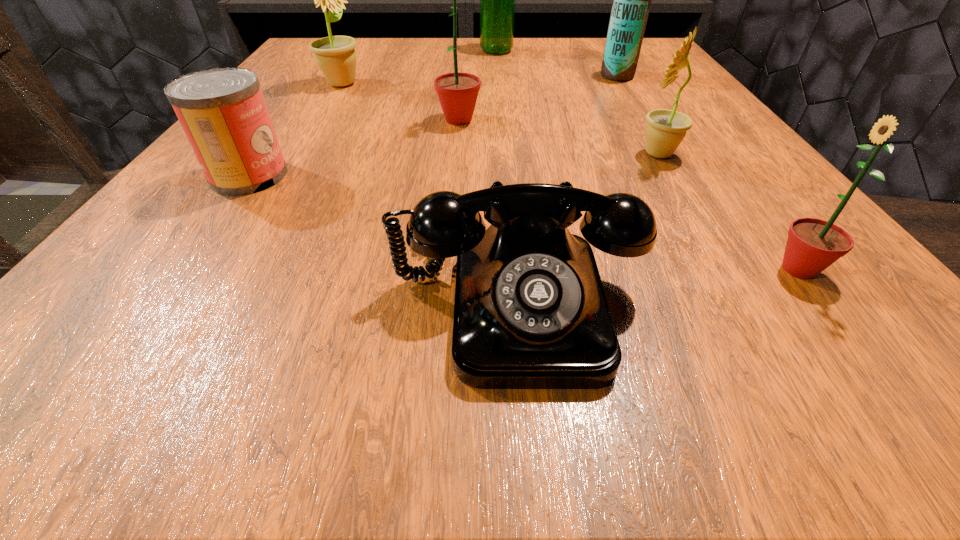
What are the coordinates of `vacant space situated on the face of the third sunflower from right to left` in the screenshot? It's located at (572, 120).

At what (x,y) coordinates should I click in order to perform the action: click on vacant position located 0.090m on the face of the third farthest sunflower. Please return your answer as a coordinate pair (x, y). Looking at the image, I should click on (578, 154).

At what (x,y) coordinates should I click in order to perform the action: click on vacant region located 0.120m on the face of the third farthest sunflower. Please return your answer as a coordinate pair (x, y). The image size is (960, 540). Looking at the image, I should click on (559, 154).

What are the coordinates of `vacant region located 0.140m on the face of the third farthest sunflower` in the screenshot? It's located at (545, 154).

Locate an element on the screen. free space located on the face of the nearest sunflower is located at coordinates (594, 269).

You are a GUI agent. You are given a task and a screenshot of the screen. Output one action in this format:
    pyautogui.click(x=<x>, y=<y>)
    Task: Click on the free spot located 0.050m on the face of the nearest sunflower
    The width and height of the screenshot is (960, 540).
    Given the screenshot: What is the action you would take?
    pyautogui.click(x=728, y=269)

Where is `vacant region located 0.270m on the face of the nearest sunflower`? Image resolution: width=960 pixels, height=540 pixels. vacant region located 0.270m on the face of the nearest sunflower is located at coordinates (533, 269).

Where is `vacant area situated on the right of the can`? This screenshot has width=960, height=540. vacant area situated on the right of the can is located at coordinates (334, 176).

Locate an element on the screen. The image size is (960, 540). object that is positioned at the near edge is located at coordinates (530, 312).

Where is `sunflower positioned at the left edge`? This screenshot has height=540, width=960. sunflower positioned at the left edge is located at coordinates (335, 55).